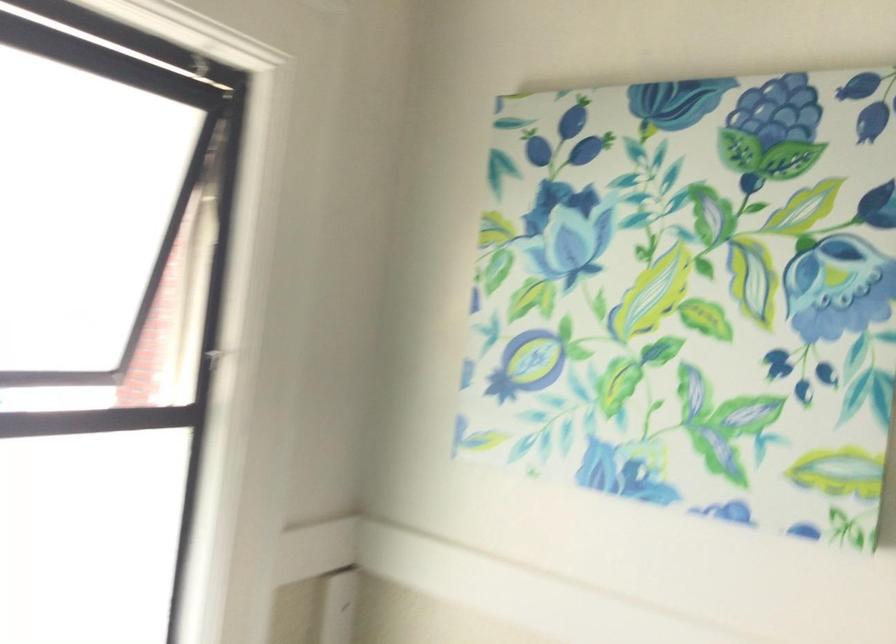
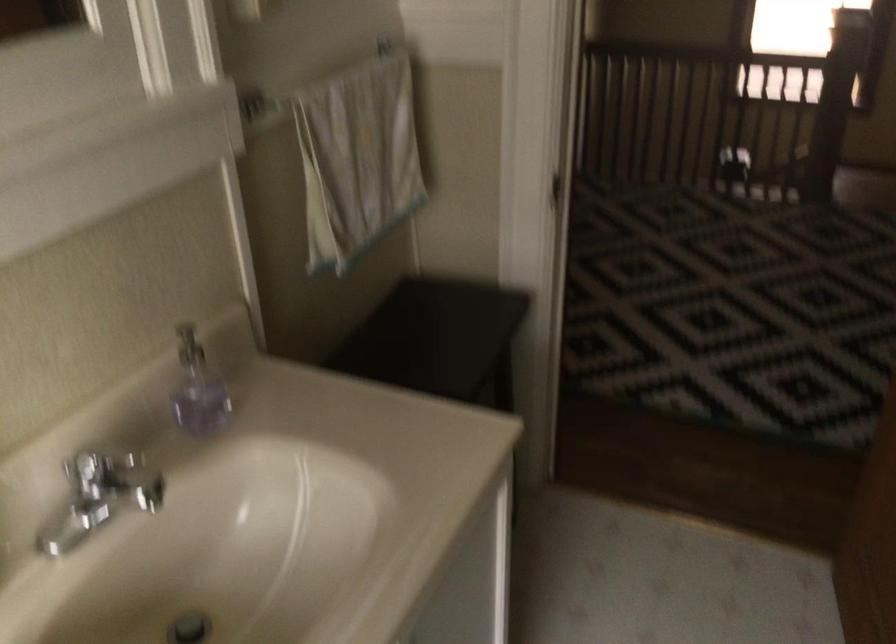
First-person continuous shooting, in which direction is the camera rotating?

The camera's rotation is toward right-down.